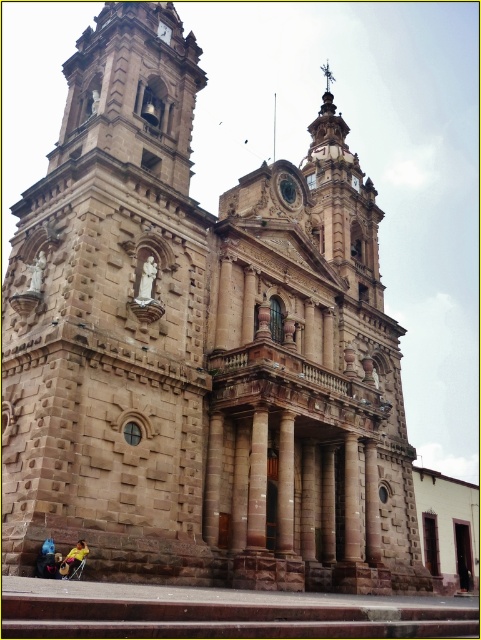
Between brown stone column at center and matte brown clock at upper center, which one has less height?

With less height is matte brown clock at upper center.

In the scene shown: Is brown stone column at center above matte brown clock at upper center?

No.

Who is more forward, (263,497) or (168,42)?

Positioned in front is point (263,497).

Find the location of a particular element. The height and width of the screenshot is (640, 481). brown stone column at center is located at coordinates (257, 483).